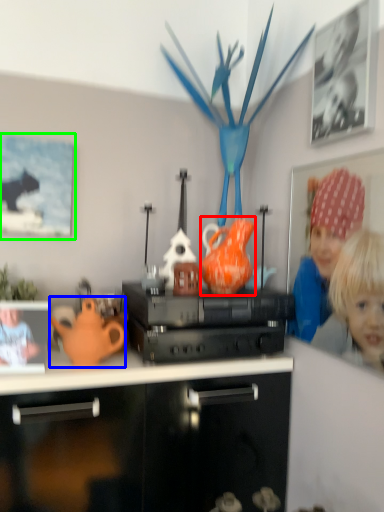
Question: Which object is positioned farthest from tea pot (highlighted by a red box)? Select from teapot (highlighted by a blue box) and picture frame (highlighted by a green box).

Choices:
 (A) teapot
 (B) picture frame

Answer: (B)